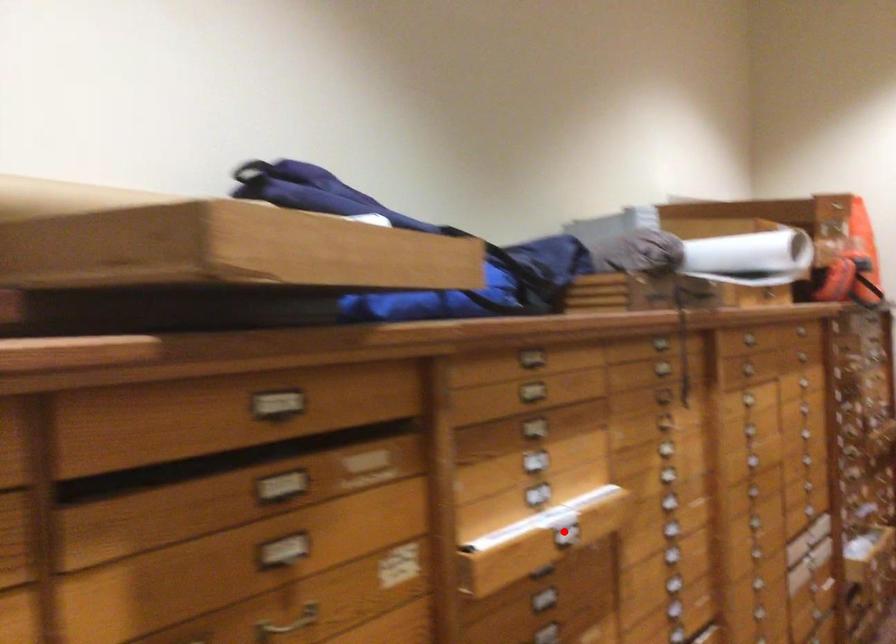
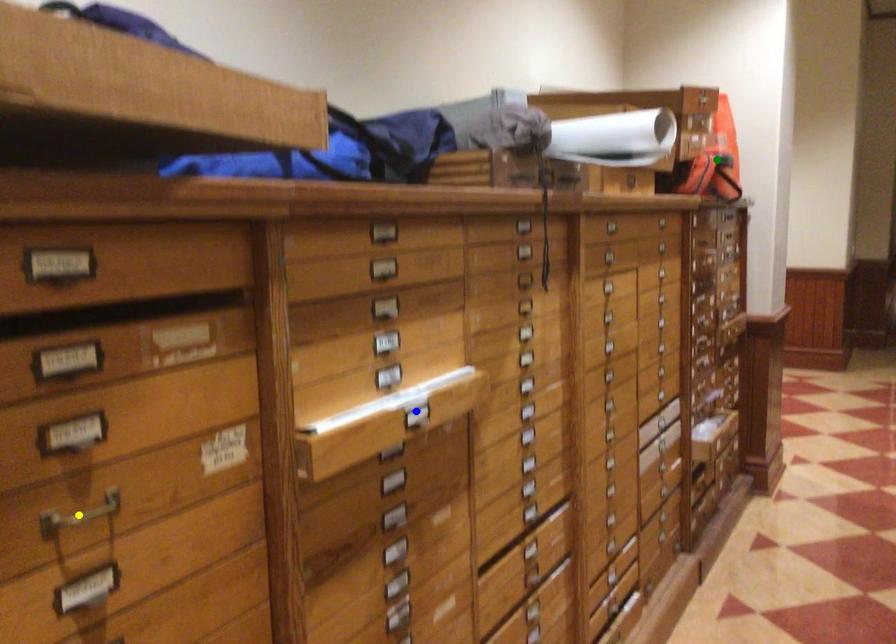
Question: I am providing you with two images of the same scene from different viewpoints. A red point is marked on the first image. You are given multiple points on the second image. In image 2, which mark is for the same physical point as the one in image 1?

Choices:
 (A) green point
 (B) yellow point
 (C) blue point

Answer: (C)